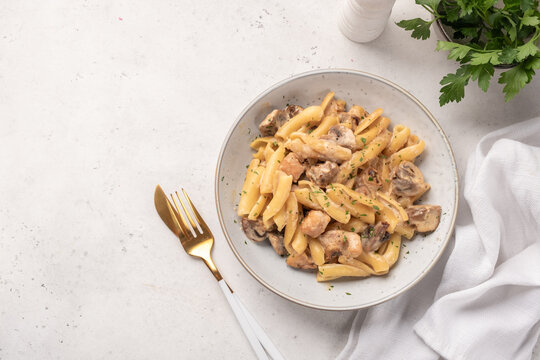
The height and width of the screenshot is (360, 540). What are the coordinates of `shallow white bowl` in the screenshot? It's located at (338, 300).